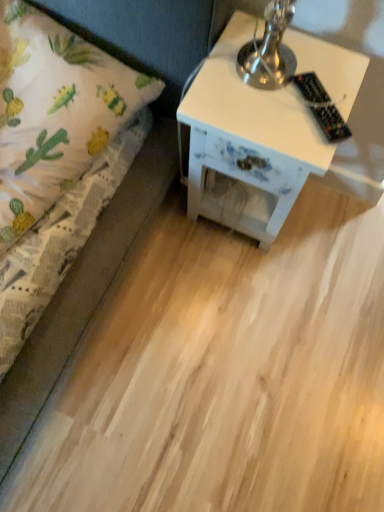
Identify the location of free spot in front of white painted wood nightstand at right. (239, 287).